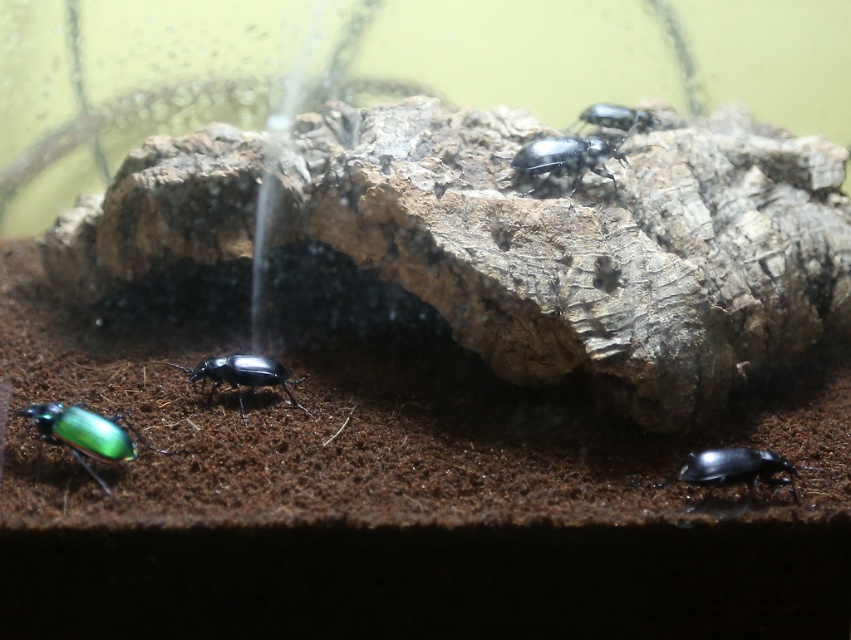
You are an entomologist observing the insects in this terrarium. You need to determine which insect is taller between the shiny metallic beetle at center and the glossy metallic beetle at upper center. Which one is taller?

The shiny metallic beetle at center is taller than the glossy metallic beetle at upper center according to the description.

You are an entomologist observing the terrarium. You notice two metallic beetles, the shiny metallic beetle at center and the glossy metallic beetle at upper center. Which beetle is positioned lower in the image?

The shiny metallic beetle at center is positioned lower than the glossy metallic beetle at upper center.

You are a small insect explorer in the terrarium. You see the glossy black beetle at lower right and the glossy metallic beetle at upper center. Which beetle is closer to you?

The glossy black beetle at lower right is closer to you because it is in front of the glossy metallic beetle at upper center.